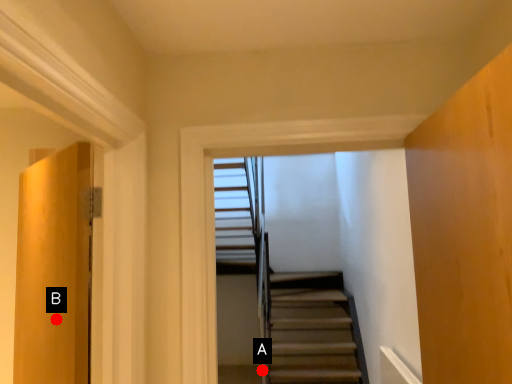
Question: Two points are circled on the image, labeled by A and B beside each circle. Which point is further to the camera?

Choices:
 (A) A is further
 (B) B is further

Answer: (A)